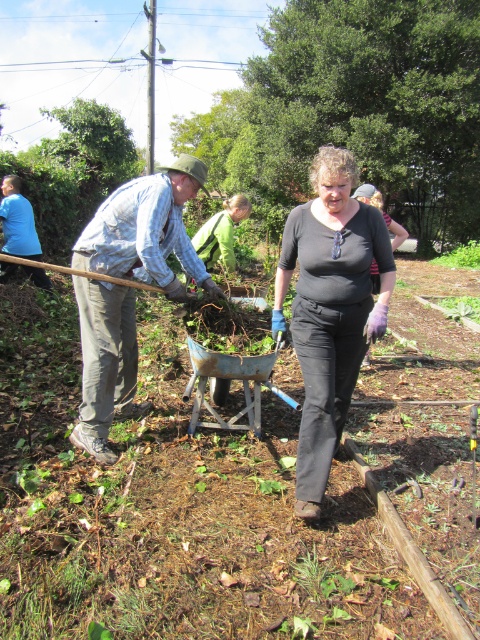
Question: Does denim jacket at left have a larger size compared to green fabric at center?

Choices:
 (A) yes
 (B) no

Answer: (B)

Question: Which point is farther from the camera taking this photo?

Choices:
 (A) (469, 250)
 (B) (218, 224)

Answer: (A)

Question: Is metallic wheelbarrow at center closer to the viewer compared to black matte shirt at center?

Choices:
 (A) yes
 (B) no

Answer: (A)

Question: Which of the following is the farthest from the observer?

Choices:
 (A) denim jacket at left
 (B) green leafy plant at center-right
 (C) green fabric at center

Answer: (B)

Question: Can you confirm if metallic wheelbarrow at center is positioned above denim shirt at center?

Choices:
 (A) no
 (B) yes

Answer: (A)

Question: Estimate the real-world distances between objects in this image. Which object is closer to the denim jacket at left?

Choices:
 (A) green fabric at center
 (B) metallic wheelbarrow at center
 (C) green leafy plant at center-right

Answer: (A)